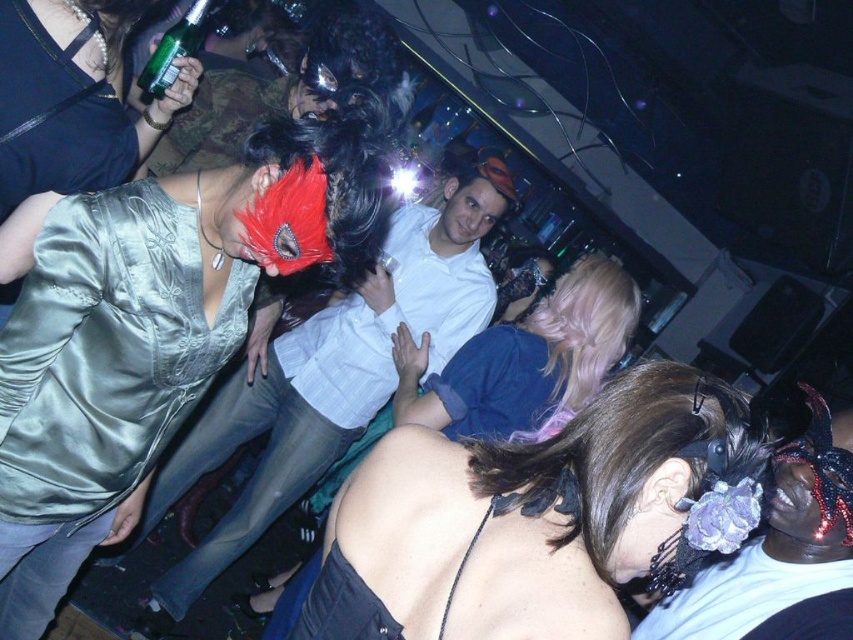
Question: Which point appears closest to the camera in this image?

Choices:
 (A) (177, 77)
 (B) (407, 465)
 (C) (22, 268)
 (D) (354, 253)

Answer: (B)

Question: Considering the relative positions of satin mask at upper left and satin black dress at center in the image provided, where is satin mask at upper left located with respect to satin black dress at center?

Choices:
 (A) below
 (B) above

Answer: (B)

Question: Where is satin black dress at center located in relation to green glass bottle at upper left in the image?

Choices:
 (A) above
 (B) below

Answer: (B)

Question: Which object is farther from the camera taking this photo?

Choices:
 (A) blonde hair at center
 (B) satin mask at upper left

Answer: (A)

Question: Which of these objects is positioned farthest from the satin silver dress at upper left?

Choices:
 (A) satin black dress at center
 (B) blonde hair at center
 (C) satin mask at upper left

Answer: (B)

Question: Does satin mask at upper left lie behind green glass bottle at upper left?

Choices:
 (A) yes
 (B) no

Answer: (B)